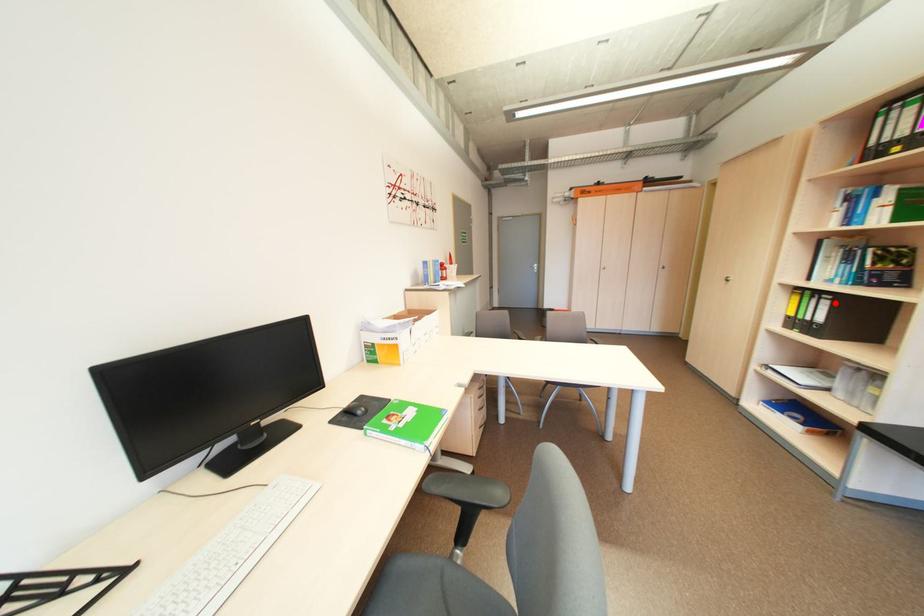
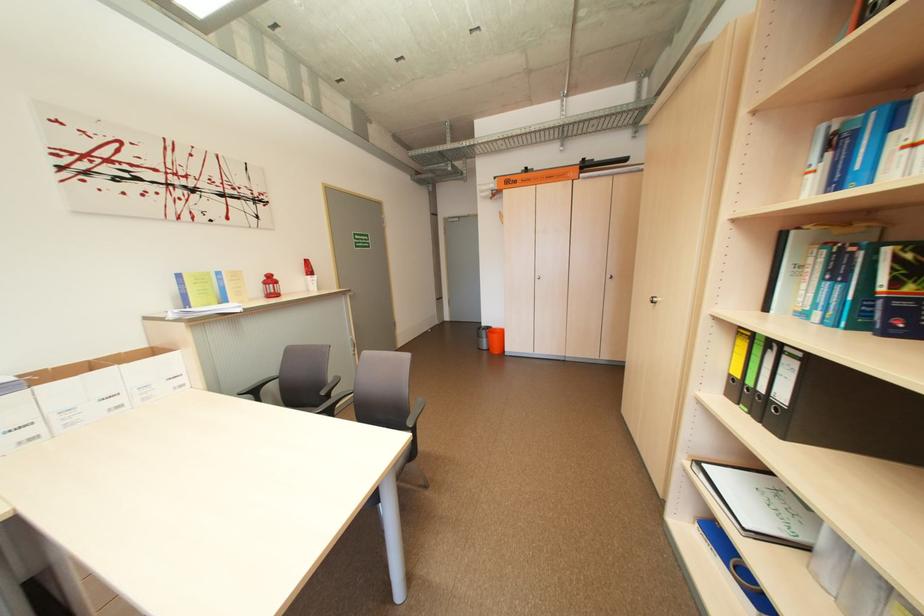
In the second image, find the point that corresponds to the highlighted location in the first image.

(800, 363)